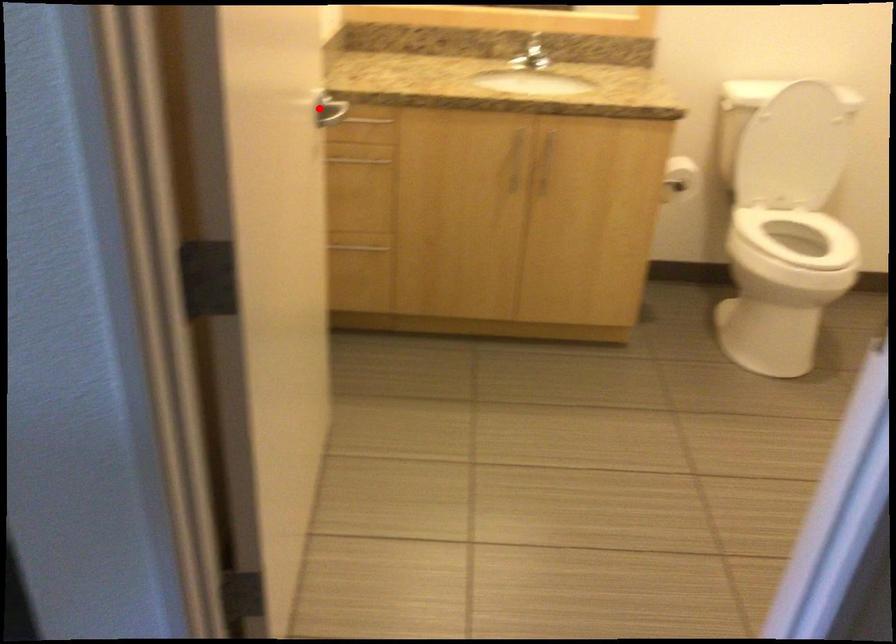
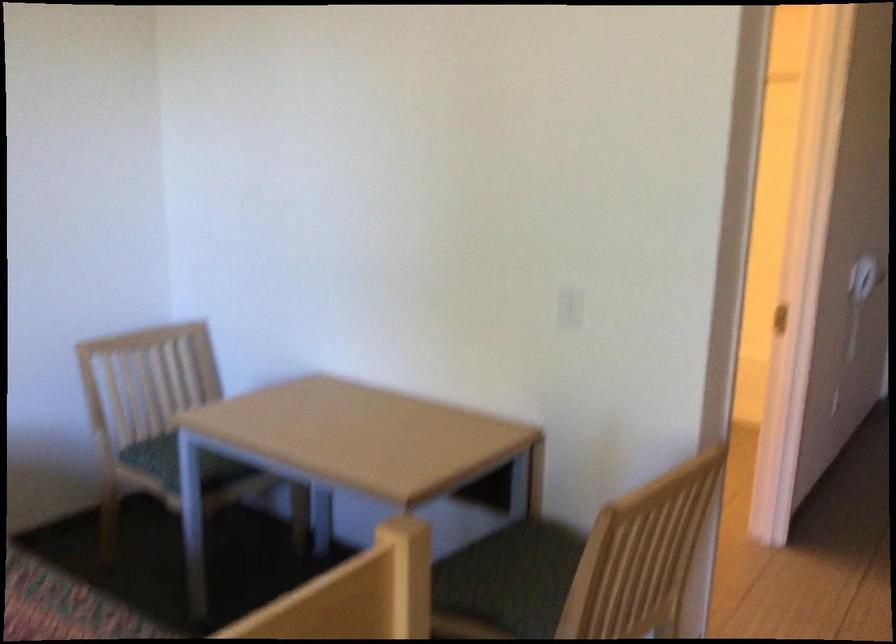
Question: I am providing you with two images of the same scene from different viewpoints. A red point is marked on the first image. Can you still see the location of the red point in image 2?

Choices:
 (A) Yes
 (B) No

Answer: (B)